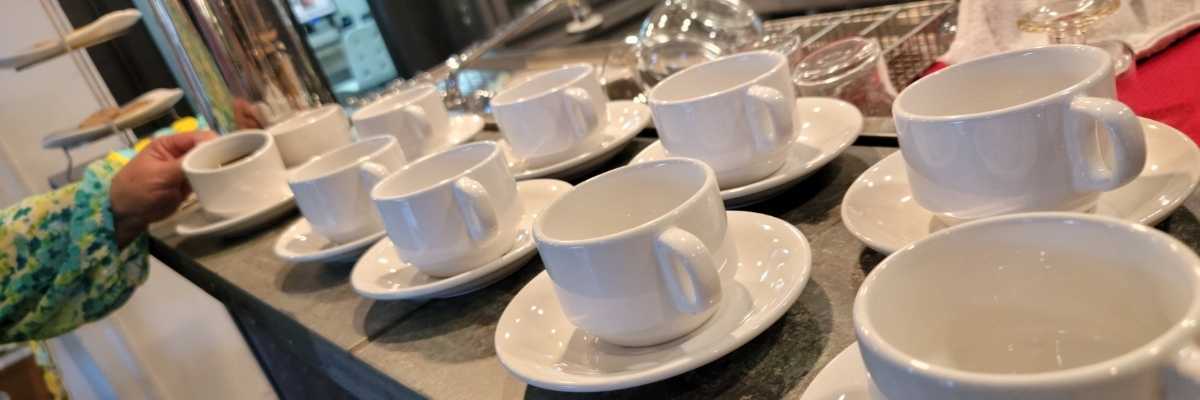
This screenshot has width=1200, height=400. What are the coordinates of `plates` in the screenshot? It's located at (613, 362), (830, 381), (868, 198), (814, 154), (410, 277), (611, 134), (461, 121), (306, 238), (244, 215).